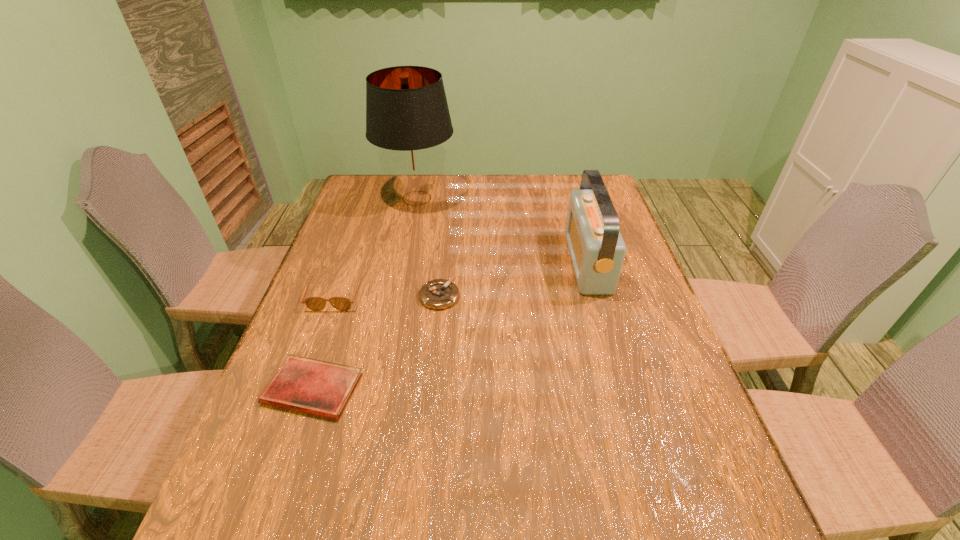
You are a GUI agent. You are given a task and a screenshot of the screen. Output one action in this format:
    pyautogui.click(x=<x>, y=<y>)
    Task: Click on the free region located on the front-facing side of the fourth shortest object
    The image size is (960, 540).
    Given the screenshot: What is the action you would take?
    pyautogui.click(x=475, y=262)

Where is `vacant space located 0.290m on the front-facing side of the fourth shortest object`? The height and width of the screenshot is (540, 960). vacant space located 0.290m on the front-facing side of the fourth shortest object is located at coordinates (472, 262).

At what (x,y) coordinates should I click in order to perform the action: click on free space located 0.140m on the front-facing side of the third shortest object. Please return your answer as a coordinate pair (x, y). The image size is (960, 540). Looking at the image, I should click on (315, 354).

I want to click on free space located on the front of the ashtray, so click(x=430, y=389).

In order to click on free space located on the right of the diary in this screenshot , I will do `click(423, 389)`.

In order to click on object that is at the far edge in this screenshot , I will do `click(407, 115)`.

You are a GUI agent. You are given a task and a screenshot of the screen. Output one action in this format:
    pyautogui.click(x=<x>, y=<y>)
    Task: Click on the lampshade situated at the left edge
    This screenshot has width=960, height=540.
    Given the screenshot: What is the action you would take?
    pyautogui.click(x=407, y=115)

The image size is (960, 540). I want to click on sunglasses present at the left edge, so click(x=313, y=303).

Find the location of a particular element. The image size is (960, 540). diary present at the left edge is located at coordinates click(x=310, y=386).

The image size is (960, 540). In order to click on object that is at the right edge in this screenshot , I will do `click(597, 250)`.